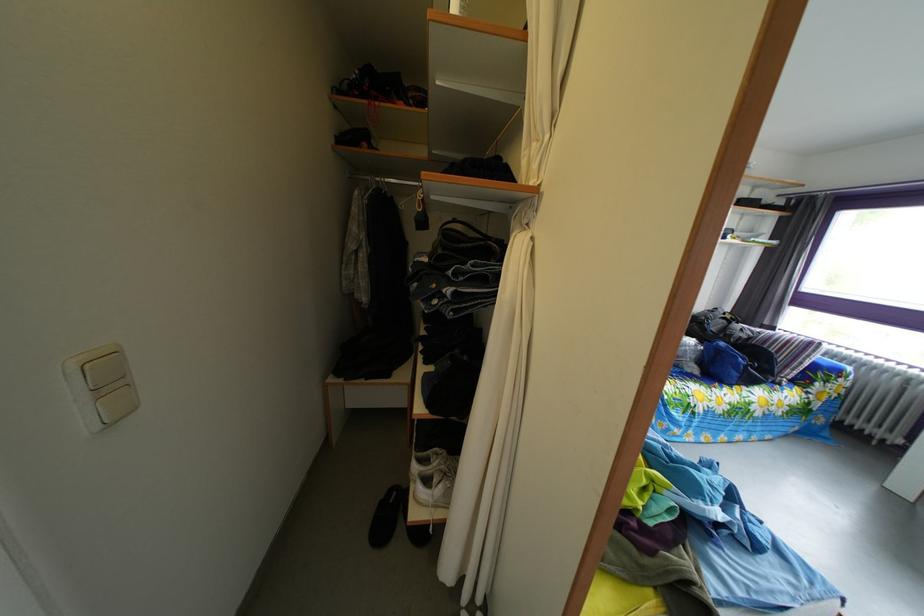
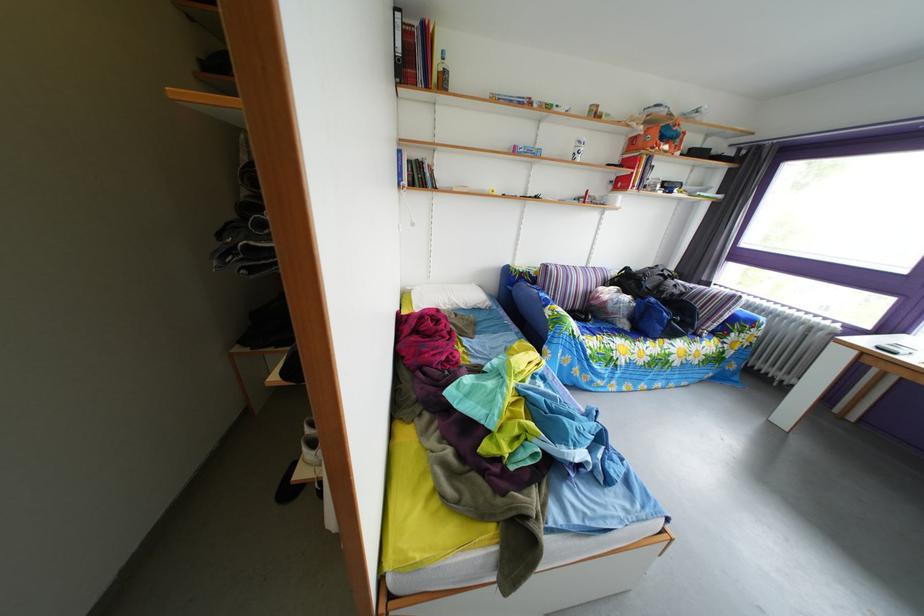
Locate, in the second image, the point that corresponds to (x=734, y=352) in the first image.

(663, 307)